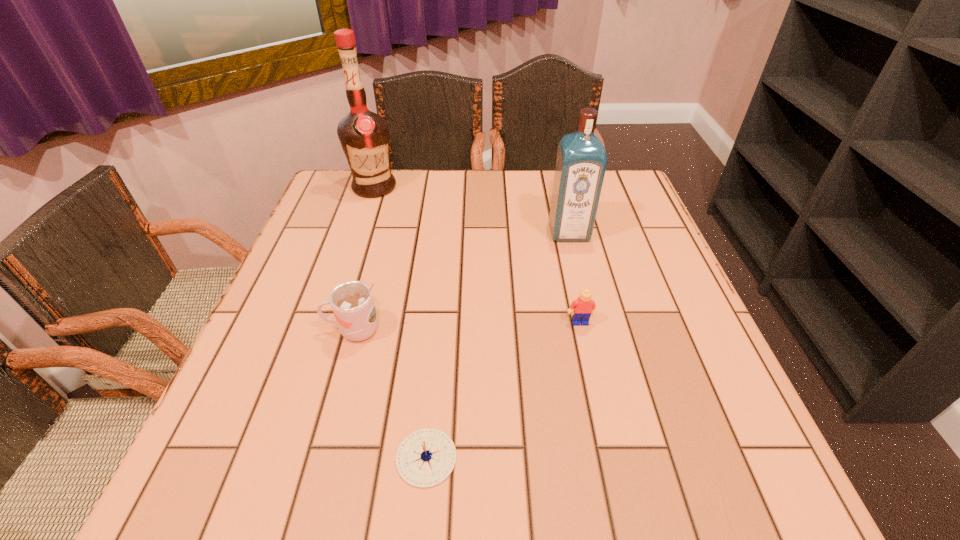
Where is `vacant space in between the compass and the right liquor`? Image resolution: width=960 pixels, height=540 pixels. vacant space in between the compass and the right liquor is located at coordinates (497, 345).

At what (x,y) coordinates should I click in order to perform the action: click on empty location between the second shortest object and the compass. Please return your answer as a coordinate pair (x, y). Image resolution: width=960 pixels, height=540 pixels. Looking at the image, I should click on (503, 390).

This screenshot has width=960, height=540. I want to click on vacant region between the third tallest object and the Lego, so click(467, 326).

Where is `free space between the left liquor and the third tallest object`? The height and width of the screenshot is (540, 960). free space between the left liquor and the third tallest object is located at coordinates (364, 259).

You are a GUI agent. You are given a task and a screenshot of the screen. Output one action in this format:
    pyautogui.click(x=<x>, y=<y>)
    Task: Click on the vacant space that is in between the Lego and the tallest object
    The height and width of the screenshot is (540, 960).
    Given the screenshot: What is the action you would take?
    pyautogui.click(x=477, y=255)

The height and width of the screenshot is (540, 960). Find the location of `unoccupied area between the fourth tallest object and the nearer liquor`. unoccupied area between the fourth tallest object and the nearer liquor is located at coordinates (574, 277).

In order to click on vacant area that lies between the third tallest object and the fourth shortest object in this screenshot , I will do `click(462, 281)`.

Locate an element on the screen. object that is the fourth closest to the shortest object is located at coordinates (364, 136).

Select which object appears as the second closest to the third tallest object. Please provide its 2D coordinates. Your answer should be formatted as a tuple, i.e. [(x, y)], where the tuple contains the x and y coordinates of a point satisfying the conditions above.

[(584, 307)]

This screenshot has height=540, width=960. In order to click on vacant space that satisfies the following two spatial constraints: 1. on the side with the handle of the compass; 2. on the left side of the third shortest object in this screenshot , I will do `click(319, 457)`.